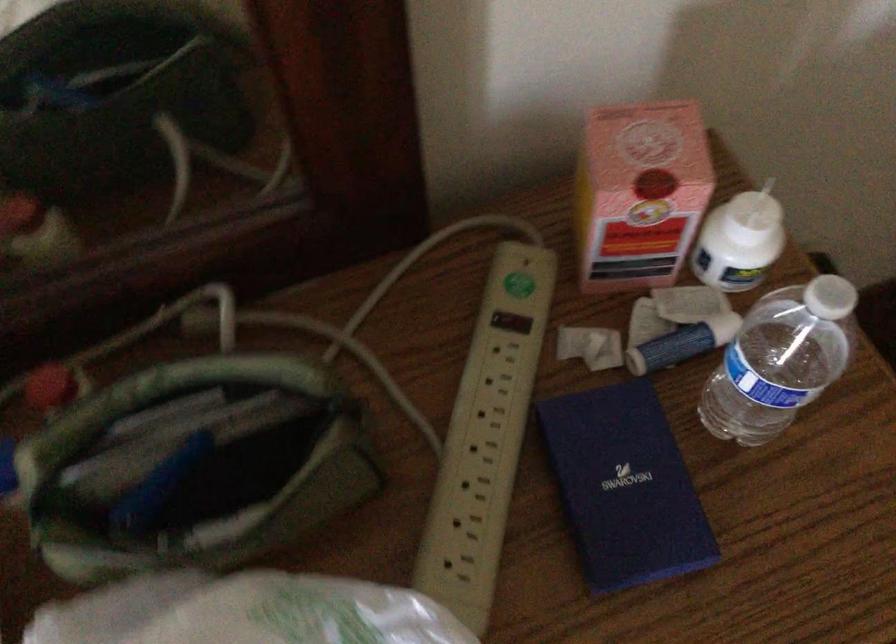
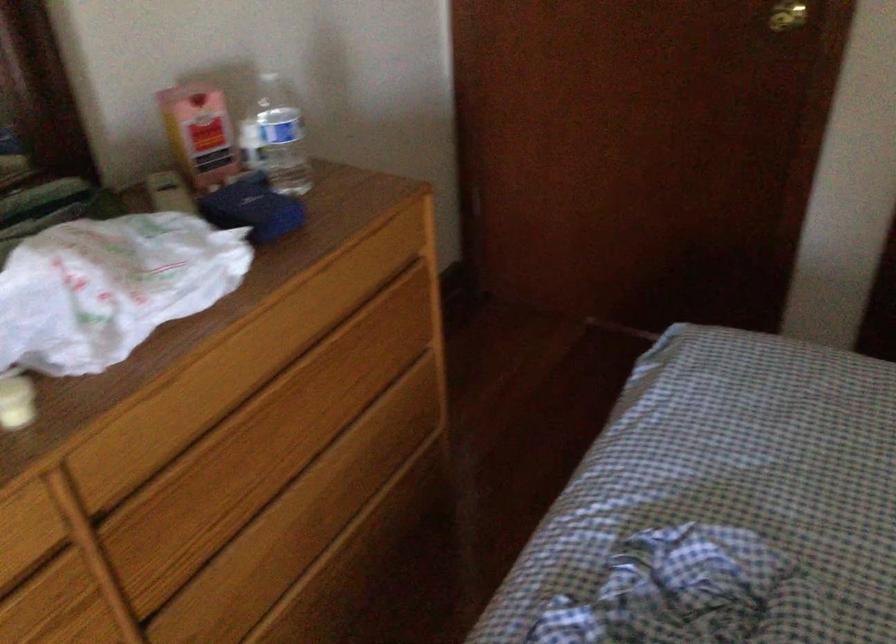
The point at (631, 240) is marked in the first image. Where is the corresponding point in the second image?

(200, 134)